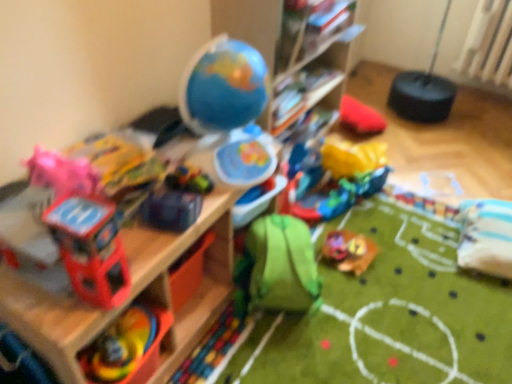
Locate an element on the screen. unoccupied area in front of shiny blue car at center, placed as the third toy when sorted from left to right is located at coordinates (147, 249).